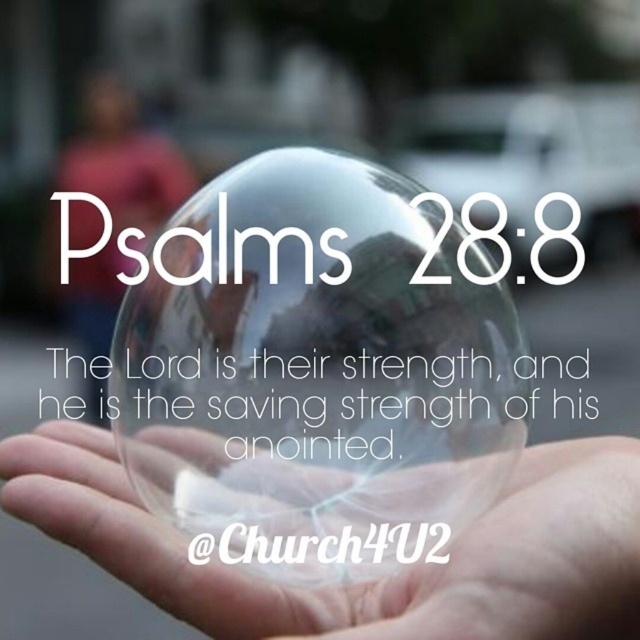
Can you confirm if transparent glass sphere at center is wider than transparent glass bubble at center?

Incorrect, transparent glass sphere at center's width does not surpass transparent glass bubble at center's.

Which is more to the left, transparent glass sphere at center or transparent glass bubble at center?

transparent glass bubble at center is more to the left.

Is point (369, 497) positioned before point (504, 541)?

No.

Find the location of a particular element. transparent glass sphere at center is located at coordinates (317, 371).

Identify the location of transparent glass sphere at center. The width and height of the screenshot is (640, 640). (317, 371).

Does transparent glass sphere at center have a lesser height compared to matte pink shirt at upper left?

Yes.

Find the location of `transparent glass sphere at center`. transparent glass sphere at center is located at coordinates (317, 371).

Can you confirm if transparent glass bubble at center is wider than matte pink shirt at upper left?

Yes, transparent glass bubble at center is wider than matte pink shirt at upper left.

Does transparent glass bubble at center appear on the left side of matte pink shirt at upper left?

In fact, transparent glass bubble at center is to the right of matte pink shirt at upper left.

Does point (474, 568) lie in front of point (77, 228)?

Yes, point (474, 568) is in front of point (77, 228).

This screenshot has width=640, height=640. In order to click on transparent glass bubble at center in this screenshot , I will do `click(369, 584)`.